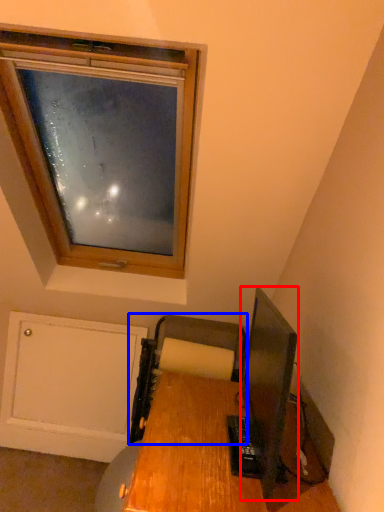
Question: Which object is closer to the camera taking this photo, television (highlighted by a red box) or printer (highlighted by a blue box)?

Choices:
 (A) television
 (B) printer

Answer: (A)